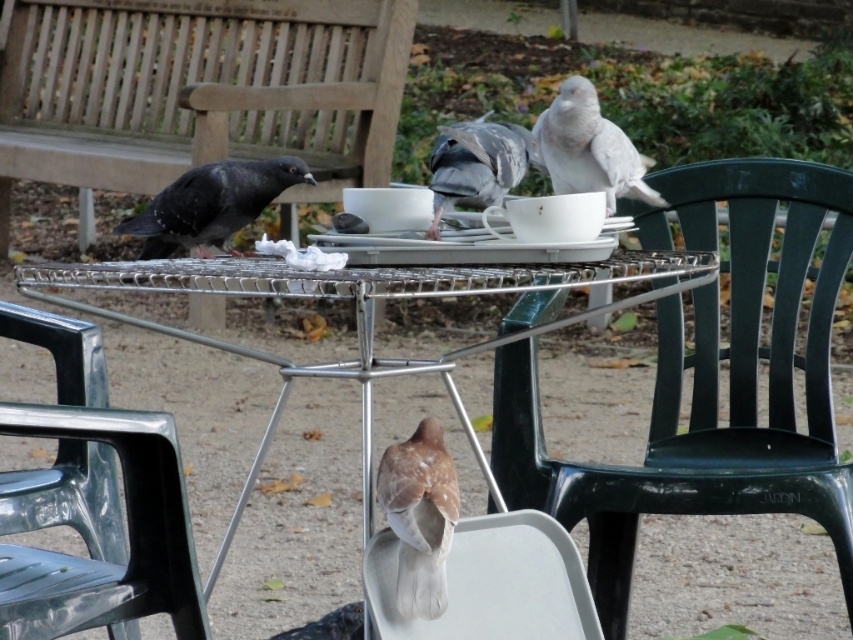
Question: Can you confirm if metallic green chair at lower left is positioned to the right of brown speckled feather at lower center?

Choices:
 (A) yes
 (B) no

Answer: (B)

Question: Is white plastic chair at lower center above brown speckled feather at lower center?

Choices:
 (A) no
 (B) yes

Answer: (A)

Question: Which object is closer to the camera taking this photo?

Choices:
 (A) green plastic chair at right
 (B) metallic silver table at center

Answer: (B)

Question: Among these objects, which one is farthest from the camera?

Choices:
 (A) brown speckled feather at lower center
 (B) metallic green chair at lower left
 (C) white matte bird at upper center

Answer: (B)

Question: Does metallic silver table at center have a greater width compared to brown speckled feather at lower center?

Choices:
 (A) yes
 (B) no

Answer: (A)

Question: Which point is closer to the camera?

Choices:
 (A) (511, 161)
 (B) (467, 429)
 (C) (495, 572)

Answer: (C)